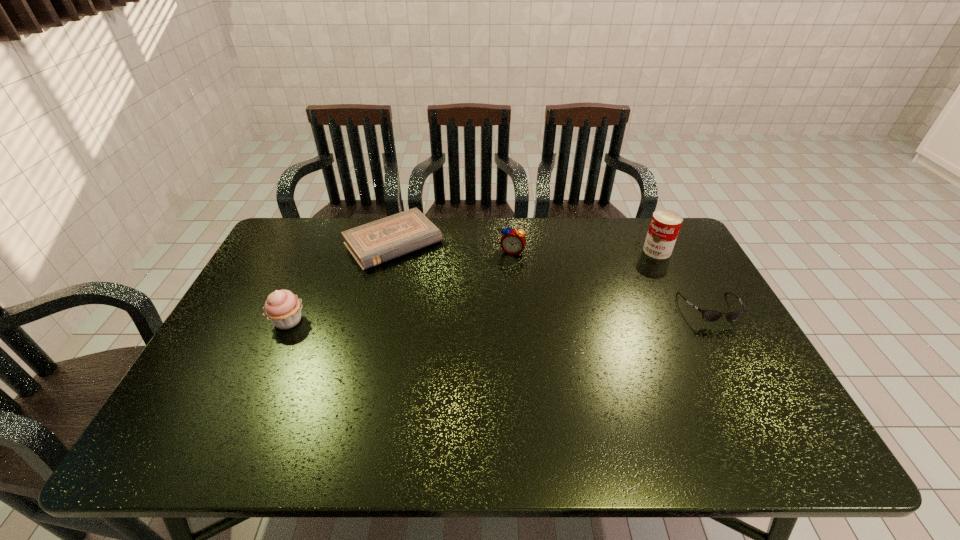
Where is `free area in between the sunglasses and the third object from left to right`? The width and height of the screenshot is (960, 540). free area in between the sunglasses and the third object from left to right is located at coordinates (611, 280).

This screenshot has height=540, width=960. I want to click on blank region between the shortest object and the alarm clock, so pyautogui.click(x=453, y=247).

Identify the location of free area in between the second shortest object and the cupcake. (499, 315).

You are a GUI agent. You are given a task and a screenshot of the screen. Output one action in this format:
    pyautogui.click(x=<x>, y=<y>)
    Task: Click on the free space between the shortest object and the cupcake
    This screenshot has width=960, height=540.
    Given the screenshot: What is the action you would take?
    pyautogui.click(x=341, y=282)

This screenshot has width=960, height=540. What are the coordinates of `empty space between the Bible and the fourth tallest object` in the screenshot? It's located at (551, 276).

Find the location of a particular element. Image resolution: width=960 pixels, height=540 pixels. vacant area that lies between the fourth tallest object and the alarm clock is located at coordinates (611, 280).

This screenshot has height=540, width=960. What are the coordinates of `free space between the third object from left to right and the cupcake` in the screenshot? It's located at [x=400, y=286].

Locate an element on the screen. This screenshot has height=540, width=960. empty space between the can and the fourth object from right to left is located at coordinates (525, 247).

Find the location of a particular element. Image resolution: width=960 pixels, height=540 pixels. free spot between the third object from right to left and the second object from left to right is located at coordinates (453, 247).

At what (x,y) coordinates should I click in order to perform the action: click on the second closest object to the tallest object. Please return your answer as a coordinate pair (x, y). The height and width of the screenshot is (540, 960). Looking at the image, I should click on (513, 241).